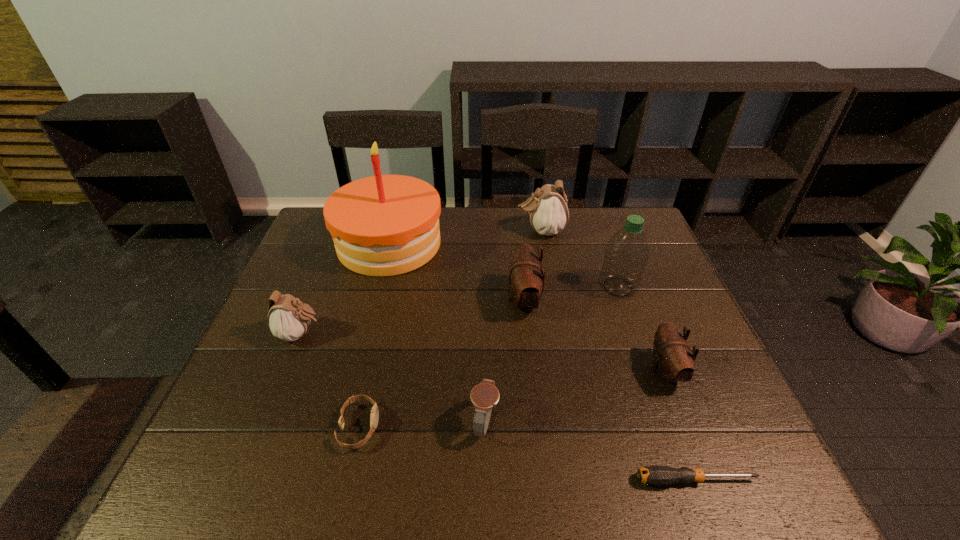
Find the location of a particular element. free spot located on the front-facing side of the bigger white pouch is located at coordinates (447, 231).

Locate an element on the screen. vacant space located 0.160m on the front-facing side of the bigger white pouch is located at coordinates (468, 231).

Image resolution: width=960 pixels, height=540 pixels. Identify the location of vacant region located 0.330m on the front-facing side of the bigger white pouch. (418, 231).

Identify the location of free space located with the flap open on the left brown pouch. (474, 300).

Locate an element on the screen. free space located with the flap open on the left brown pouch is located at coordinates (438, 300).

This screenshot has height=540, width=960. In order to click on vacant region located 0.070m with the flap open on the left brown pouch in this screenshot , I will do `click(481, 300)`.

Where is `vacant space located 0.270m on the front-facing side of the nearer white pouch`? vacant space located 0.270m on the front-facing side of the nearer white pouch is located at coordinates (430, 334).

The width and height of the screenshot is (960, 540). I want to click on vacant space located with the flap open on the smaller brown pouch, so click(497, 371).

Identify the location of free space located 0.100m with the flap open on the smaller brown pouch. This screenshot has width=960, height=540. (608, 371).

What are the coordinates of `blank space located with the flap open on the smaller brown pouch` in the screenshot? It's located at (489, 371).